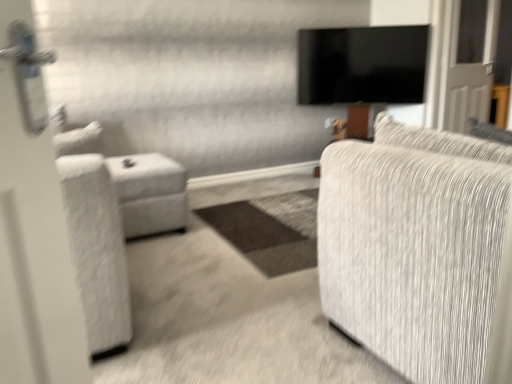
Question: Considering the positions of textured gray fabric couch at right and white fabric ottoman at left in the image, is textured gray fabric couch at right wider or thinner than white fabric ottoman at left?

Choices:
 (A) thin
 (B) wide

Answer: (B)

Question: From the image's perspective, relative to white fabric ottoman at left, is textured gray fabric couch at right above or below?

Choices:
 (A) below
 (B) above

Answer: (A)

Question: Which of these objects is positioned closest to the textured gray fabric couch at right?

Choices:
 (A) white fabric ottoman at left
 (B) black glossy tv at upper center

Answer: (A)

Question: Which object is the farthest from the white fabric ottoman at left?

Choices:
 (A) black glossy tv at upper center
 (B) textured gray fabric couch at right

Answer: (A)